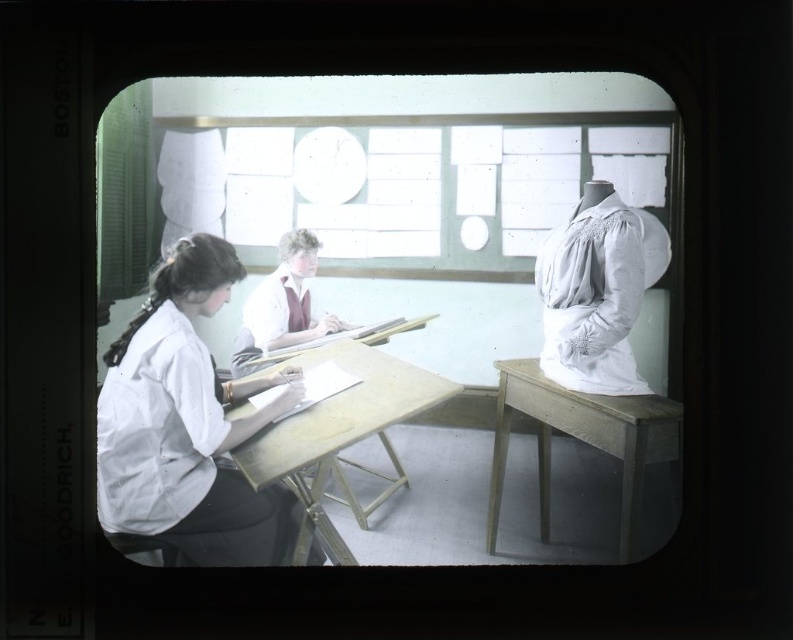
Question: Which object is closer to the camera taking this photo?

Choices:
 (A) wooden table at right
 (B) white cotton blouse at left

Answer: (B)

Question: Estimate the real-world distances between objects in this image. Which object is farther from the wooden table at center?

Choices:
 (A) white cotton blouse at right
 (B) white matte shirt at center
 (C) white cotton blouse at left

Answer: (A)

Question: Does white cotton blouse at left have a lesser width compared to white matte shirt at center?

Choices:
 (A) no
 (B) yes

Answer: (A)

Question: Can you confirm if wooden table at center is smaller than wooden table at right?

Choices:
 (A) yes
 (B) no

Answer: (B)

Question: Among these points, which one is nearest to the camera?

Choices:
 (A) (585, 339)
 (B) (142, 355)
 (C) (341, 328)

Answer: (B)

Question: Is white cotton blouse at left closer to camera compared to wooden table at center?

Choices:
 (A) no
 (B) yes

Answer: (B)